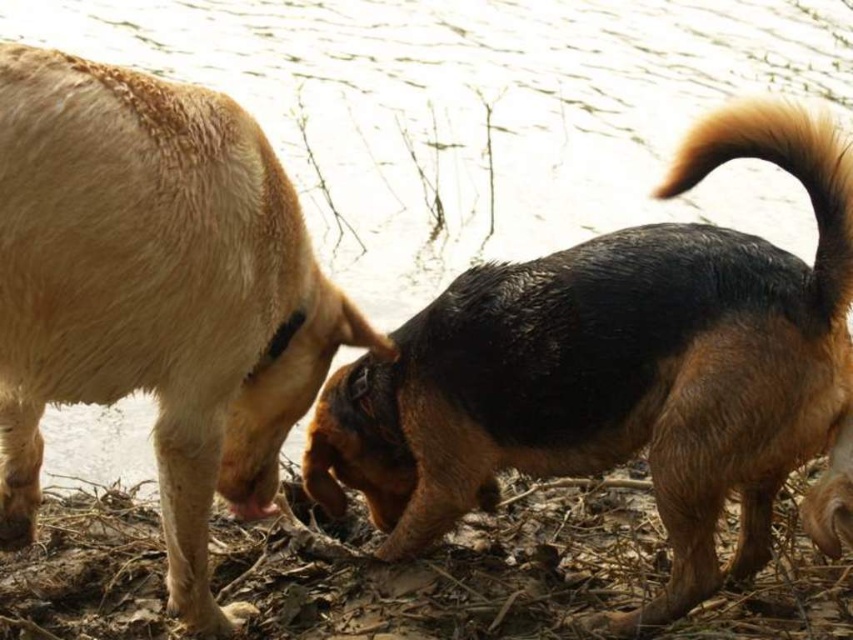
You are a photographer trying to capture both the brown fur dog at right and the brown fuzzy tail at upper right in a single shot. Which object should you focus on first to ensure both are in frame?

You should focus on the brown fur dog at right first because it is closer to you than the brown fuzzy tail at upper right, ensuring both are in frame.

You are a hiker who spots two dogs near a riverbank. You see the brown fur dog at right and the brown fuzzy tail at upper right. Which of these two is located lower in the image?

The brown fur dog at right is positioned under brown fuzzy tail at upper right, so the brown fur dog at right is lower in the image.

You are a hiker who spots two dogs near a water body. You see the brown fur dog at right and the brown fuzzy tail at upper right. Which of these two is positioned more to the left?

The brown fur dog at right is positioned more to the left than the brown fuzzy tail at upper right.